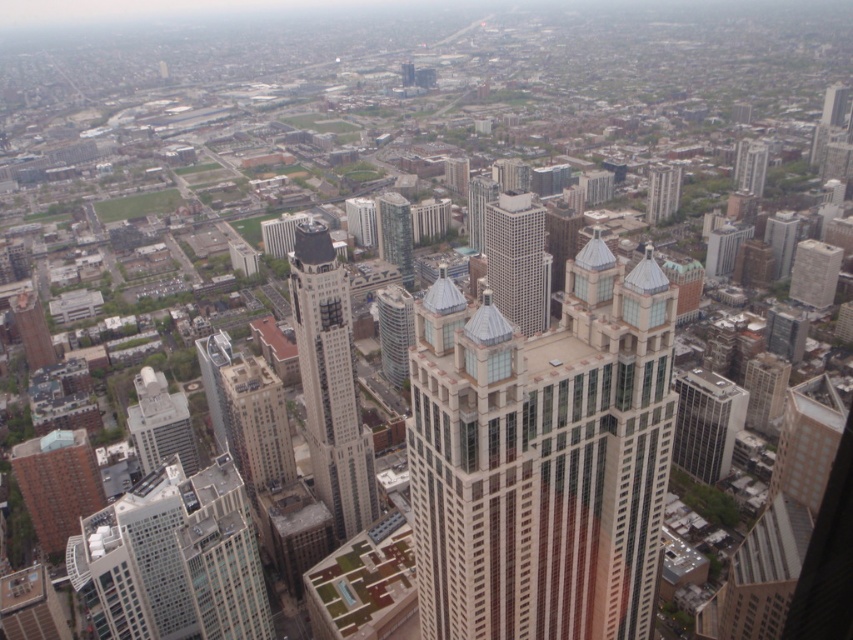
Consider the image. You are a city planner reviewing this aerial image. You need to determine the relative positions of the glassy tan skyscraper at center and the white glass building at lower left. Which building is located to the right of the other?

The glassy tan skyscraper at center is positioned on the right side of the white glass building at lower left, meaning it is to the right of the white glass building at lower left.

You are a drone operator trying to capture aerial shots of the city. You have two points marked on your map, point [167,424] and point [386,237]. If you want to focus on the closer point to your camera, which point should you choose?

Point [167,424] is further to the camera than point [386,237], so the closer point to the camera is point [386,237].

You are a drone operator trying to navigate between the matte gray building at lower left and the glassy reflective skyscraper at center. Which building is closer to you as you fly over the area?

The matte gray building at lower left is closer to you because it is positioned further to the viewer than the glassy reflective skyscraper at center, meaning it appears nearer in the aerial view.